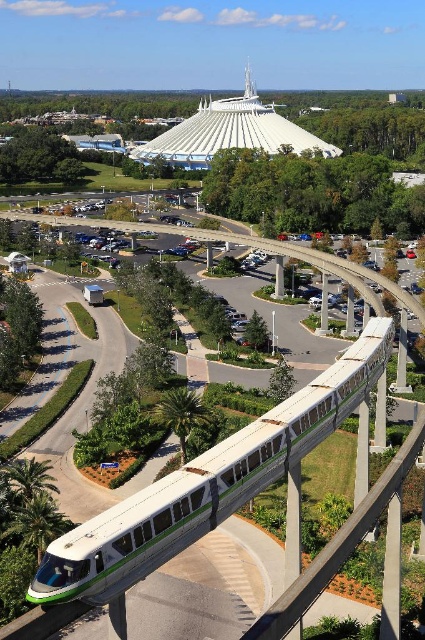
Based on the photo, which is more to the right, green matte monorail at center or white smooth dome at upper center?

green matte monorail at center is more to the right.

Who is positioned more to the left, green matte monorail at center or white smooth dome at upper center?

Positioned to the left is white smooth dome at upper center.

Is point (311, 396) positioned in front of point (249, 100)?

That is True.

You are a GUI agent. You are given a task and a screenshot of the screen. Output one action in this format:
    pyautogui.click(x=<x>, y=<y>)
    Task: Click on the green matte monorail at center
    Image resolution: width=425 pixels, height=640 pixels.
    Given the screenshot: What is the action you would take?
    pyautogui.click(x=206, y=483)